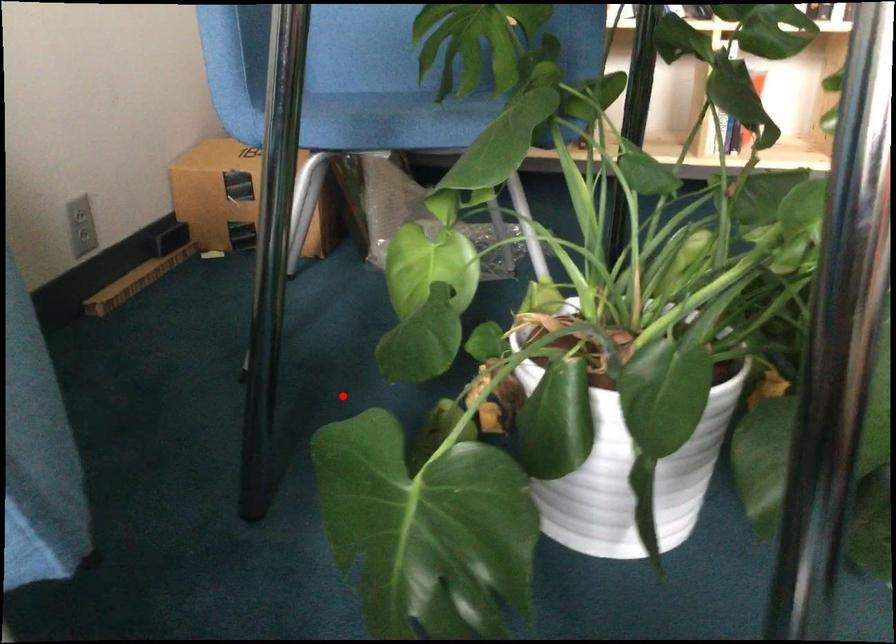
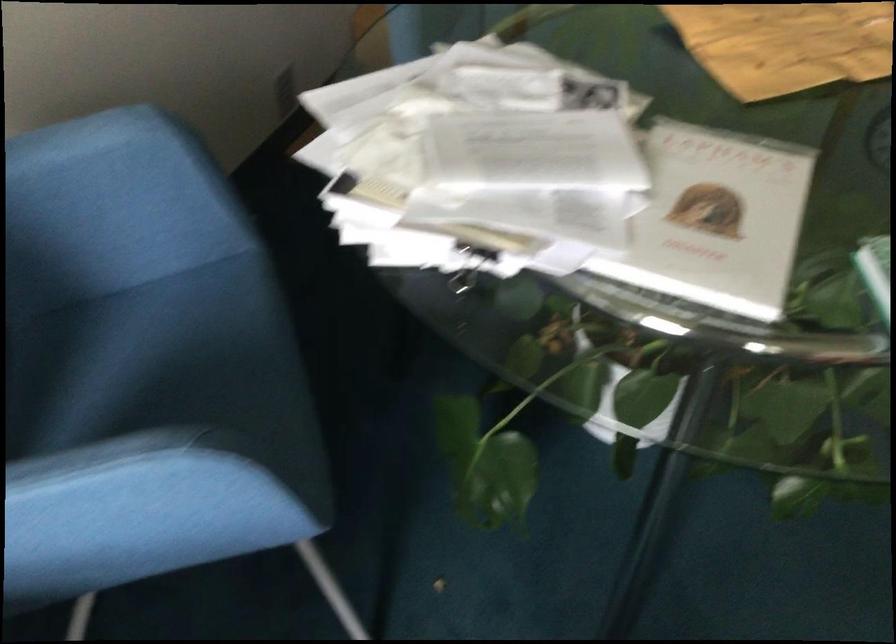
Locate, in the second image, the point that corresponds to the highlighted location in the first image.

(469, 269)